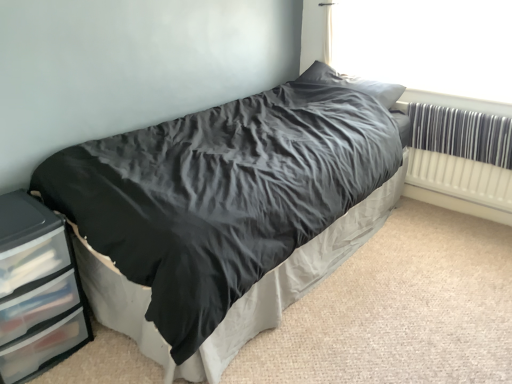
Question: Is the position of clear plastic chest of drawers at lower left more distant than that of transparent plastic window screen at upper right?

Choices:
 (A) yes
 (B) no

Answer: (B)

Question: Can you confirm if clear plastic chest of drawers at lower left is smaller than transparent plastic window screen at upper right?

Choices:
 (A) no
 (B) yes

Answer: (A)

Question: Is clear plastic chest of drawers at lower left directly adjacent to transparent plastic window screen at upper right?

Choices:
 (A) no
 (B) yes

Answer: (A)

Question: Is clear plastic chest of drawers at lower left shorter than transparent plastic window screen at upper right?

Choices:
 (A) yes
 (B) no

Answer: (B)

Question: Is clear plastic chest of drawers at lower left oriented away from transparent plastic window screen at upper right?

Choices:
 (A) no
 (B) yes

Answer: (A)

Question: Is clear plastic chest of drawers at lower left outside transparent plastic window screen at upper right?

Choices:
 (A) yes
 (B) no

Answer: (A)

Question: Does white plastic radiator at right have a lesser height compared to transparent plastic window screen at upper right?

Choices:
 (A) no
 (B) yes

Answer: (A)

Question: From a real-world perspective, is white plastic radiator at right positioned under transparent plastic window screen at upper right based on gravity?

Choices:
 (A) no
 (B) yes

Answer: (B)

Question: Is white plastic radiator at right completely or partially outside of transparent plastic window screen at upper right?

Choices:
 (A) yes
 (B) no

Answer: (A)

Question: Does white plastic radiator at right come in front of transparent plastic window screen at upper right?

Choices:
 (A) yes
 (B) no

Answer: (B)

Question: Can you confirm if white plastic radiator at right is positioned to the left of transparent plastic window screen at upper right?

Choices:
 (A) yes
 (B) no

Answer: (B)

Question: Is white plastic radiator at right oriented away from transparent plastic window screen at upper right?

Choices:
 (A) yes
 (B) no

Answer: (B)

Question: Does satin gray pillow at upper center have a larger size compared to white plastic radiator at right?

Choices:
 (A) no
 (B) yes

Answer: (B)